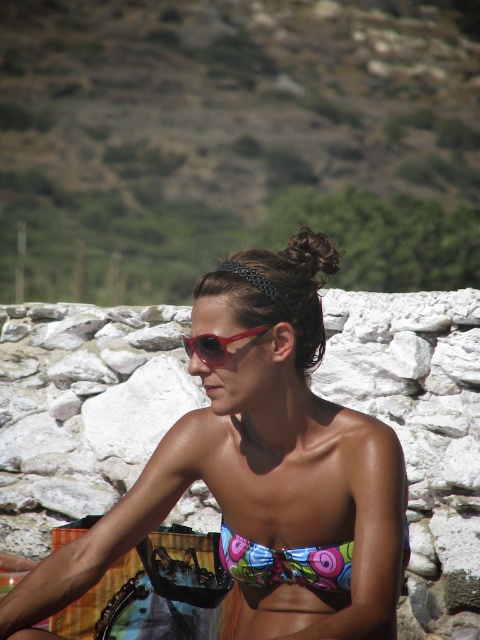
Who is positioned more to the right, matte pink sunglasses at center or multicolored fabric bikini at center?

From the viewer's perspective, multicolored fabric bikini at center appears more on the right side.

Does matte pink sunglasses at center appear over multicolored fabric bikini at center?

Indeed, matte pink sunglasses at center is positioned over multicolored fabric bikini at center.

Describe the element at coordinates (262, 472) in the screenshot. I see `matte pink sunglasses at center` at that location.

Where is `matte pink sunglasses at center`? matte pink sunglasses at center is located at coordinates (262, 472).

Does matte pink sunglasses at center have a smaller size compared to shiny red sunglasses at center?

Incorrect, matte pink sunglasses at center is not smaller in size than shiny red sunglasses at center.

Is matte pink sunglasses at center below shiny red sunglasses at center?

Yes, matte pink sunglasses at center is below shiny red sunglasses at center.

Which is behind, point (355, 636) or point (260, 326)?

Point (260, 326)

Where is `matte pink sunglasses at center`? The image size is (480, 640). matte pink sunglasses at center is located at coordinates (262, 472).

Is multicolored fabric bikini at center thinner than shiny red sunglasses at center?

No.

Is multicolored fabric bikini at center shorter than shiny red sunglasses at center?

Incorrect, multicolored fabric bikini at center's height does not fall short of shiny red sunglasses at center's.

The image size is (480, 640). What are the coordinates of `multicolored fabric bikini at center` in the screenshot? It's located at (286, 563).